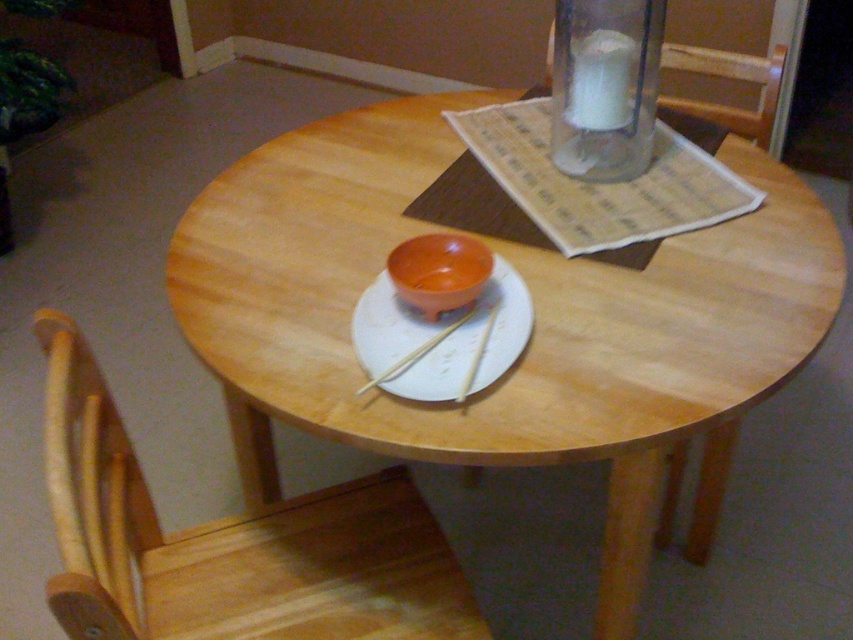
You are setting up a dining table and want to place a small dessert on the table. You have a white matte plate at center and a matte orange bowl at center. Which object should you choose to place the dessert on if you want it to be more visible?

The white matte plate at center has a larger size compared to the matte orange bowl at center, so placing the dessert on the white matte plate at center would make it more visible.

You are standing at the center of the room and see the wooden round table at center. Can you determine if the point at coordinates (534, 326) is located on the table?

The point at coordinates (534, 326) is located on the wooden round table at center.

You are setting up a small dinner party and want to place a decorative centerpiece on the wooden round table at center. Considering the size of the transparent glass candle at upper center, will there be enough space to place the centerpiece without it overlapping with the candle?

The wooden round table at center is larger in size than the transparent glass candle at upper center, so there should be enough space to place the centerpiece without overlapping with the candle.